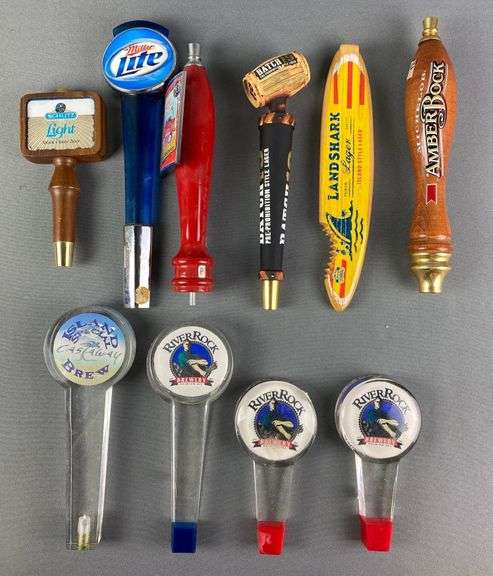
The image size is (493, 576). I want to click on right side tap handles, so click(273, 433), click(385, 407), click(261, 180), click(344, 168), click(417, 151).